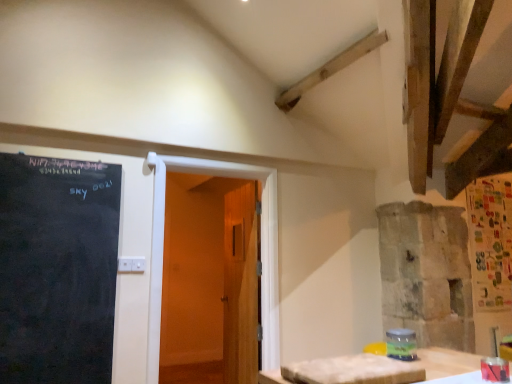
Question: Does blackboard at left have a greater width compared to wooden door at center, which ranks as the second door in back-to-front order?

Choices:
 (A) no
 (B) yes

Answer: (A)

Question: Is blackboard at left not close to wooden door at center, which ranks as the second door in back-to-front order?

Choices:
 (A) yes
 (B) no

Answer: (B)

Question: From a real-world perspective, is blackboard at left beneath wooden door at center, which ranks as the second door in back-to-front order?

Choices:
 (A) no
 (B) yes

Answer: (A)

Question: Is blackboard at left positioned before wooden door at center, which ranks as the second door in back-to-front order?

Choices:
 (A) yes
 (B) no

Answer: (A)

Question: Is the position of blackboard at left more distant than that of wooden door at center, which ranks as the second door in back-to-front order?

Choices:
 (A) yes
 (B) no

Answer: (B)

Question: Would you say white textured table at lower right is to the left or to the right of wooden door at center, acting as the second door starting from the front, in the picture?

Choices:
 (A) left
 (B) right

Answer: (B)

Question: Do you think white textured table at lower right is within wooden door at center, acting as the second door starting from the front, or outside of it?

Choices:
 (A) outside
 (B) inside

Answer: (A)

Question: Considering the positions of white textured table at lower right and wooden door at center, acting as the second door starting from the front, in the image, is white textured table at lower right taller or shorter than wooden door at center, acting as the second door starting from the front,?

Choices:
 (A) tall
 (B) short

Answer: (B)

Question: Considering the positions of white textured table at lower right and wooden door at center, the first door when ordered from back to front, in the image, is white textured table at lower right bigger or smaller than wooden door at center, the first door when ordered from back to front,?

Choices:
 (A) big
 (B) small

Answer: (B)

Question: Based on their positions, is wooden door at center, the 1th door in the front-to-back sequence, located to the left or right of wooden door at center, acting as the second door starting from the front?

Choices:
 (A) left
 (B) right

Answer: (A)

Question: Does point (271, 344) appear closer or farther from the camera than point (245, 334)?

Choices:
 (A) farther
 (B) closer

Answer: (B)

Question: In the image, is wooden door at center, the 1th door in the front-to-back sequence, positioned in front of or behind wooden door at center, acting as the second door starting from the front?

Choices:
 (A) behind
 (B) front

Answer: (B)

Question: Considering the positions of wooden door at center, which ranks as the second door in back-to-front order, and wooden door at center, acting as the second door starting from the front, in the image, is wooden door at center, which ranks as the second door in back-to-front order, taller or shorter than wooden door at center, acting as the second door starting from the front,?

Choices:
 (A) short
 (B) tall

Answer: (A)

Question: From the image's perspective, is wooden door at center, the 1th door in the front-to-back sequence, above or below blackboard at left?

Choices:
 (A) below
 (B) above

Answer: (A)

Question: Do you think wooden door at center, which ranks as the second door in back-to-front order, is within blackboard at left, or outside of it?

Choices:
 (A) inside
 (B) outside

Answer: (B)